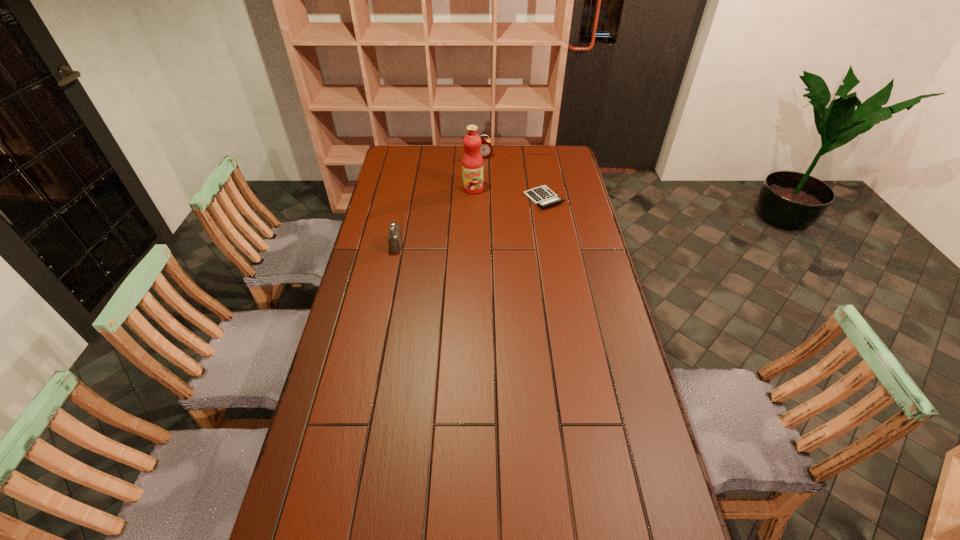
This screenshot has height=540, width=960. In order to click on vacant spot on the desktop that is between the padlock and the calculator and is positioned on the front-facing side of the farthest object in this screenshot , I will do `click(494, 214)`.

Locate an element on the screen. free spot on the desktop that is between the padlock and the shortest object and is positioned on the front label of the fruit juice is located at coordinates (470, 222).